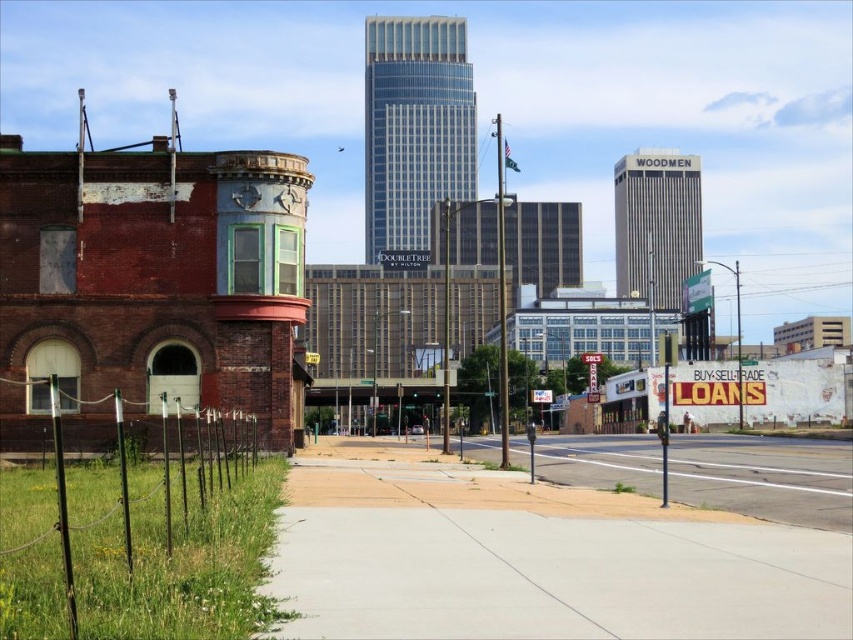
You are a delivery person trying to deliver a package to the red brick building with a curved bay window. You have to walk from the parking meter to the building. Which object, the gray concrete sidewalk at center or the transparent glass skyscraper at center, will you step on first?

The gray concrete sidewalk at center has a lesser height compared to the transparent glass skyscraper at center, so you will step on the gray concrete sidewalk at center first since it is at ground level and the skyscraper is much taller.

You are standing on the gray concrete sidewalk at center looking towards the gray concrete skyscraper at center. Which object is closer to you?

The gray concrete sidewalk at center is closer to you because it is below the gray concrete skyscraper at center, indicating it is positioned lower and nearer in the scene.

You are a city planner evaluating the urban layout. You need to determine if the gray concrete sidewalk at center can physically support the height of the gray concrete skyscraper at center. Based on the scene, what is your conclusion?

The gray concrete sidewalk at center is not as tall as the gray concrete skyscraper at center, meaning the sidewalk is shorter in height. Since the sidewalk is lower, it cannot physically support the height of the skyscraper which is taller.